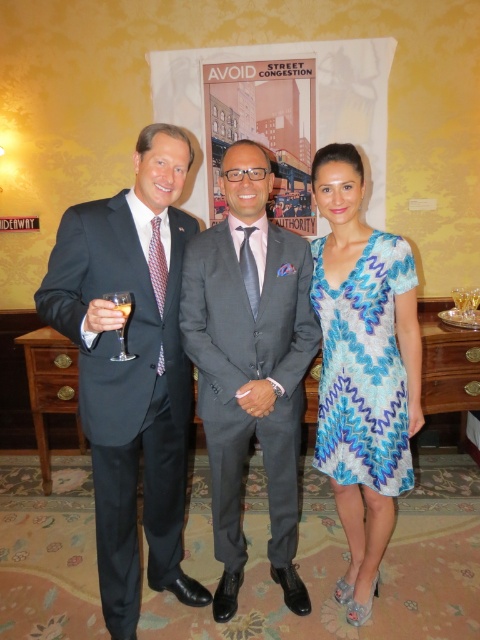
Is matte black suit at left above blue lace dress at center?

No.

Can you confirm if matte black suit at left is positioned below blue lace dress at center?

Yes.

The height and width of the screenshot is (640, 480). Identify the location of matte black suit at left. (132, 369).

Between matte black suit at center and blue lace dress at center, which one has more height?

Standing taller between the two is matte black suit at center.

The width and height of the screenshot is (480, 640). What do you see at coordinates (190, 356) in the screenshot?
I see `matte black suit at center` at bounding box center [190, 356].

You are a GUI agent. You are given a task and a screenshot of the screen. Output one action in this format:
    pyautogui.click(x=<x>, y=<y>)
    Task: Click on the matte black suit at center
    The image size is (480, 640).
    Given the screenshot: What is the action you would take?
    pyautogui.click(x=190, y=356)

Does gray suit at center have a smaller size compared to clear glass wine glass at left?

Actually, gray suit at center might be larger than clear glass wine glass at left.

Who is more forward, (230, 179) or (121, 332)?

Positioned in front is point (121, 332).

Between point (231, 317) and point (122, 349), which one is positioned behind?

The point (231, 317) is more distant.

This screenshot has height=640, width=480. What are the coordinates of `gray suit at center` in the screenshot? It's located at (250, 365).